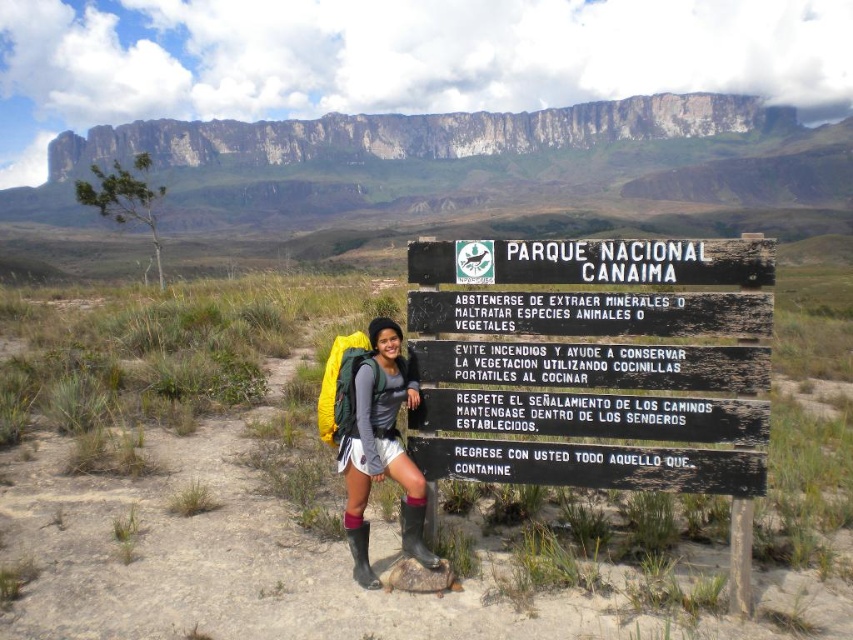
You are a hiker standing in front of the black wooden sign at center in Parque Nacional Canaima. You want to read the rules listed on the signboard without moving closer. Can you read the text clearly from your current position?

The black wooden sign at center is 5.04 meters away from viewer. Since the sign is 5.04 meters away and the text is written in Spanish, it might be difficult to read the text clearly without moving closer. However, the exact readability depends on factors like the text size and your eyesight, but the distance itself doesn

You are a park ranger in Canaima National Park. You need to check the rules on the black wooden sign at center and also ensure the matte green backpack at center is accessible. Since both are at center, which one is easier to reach without moving your position?

The matte green backpack at center is easier to reach because it is located below the black wooden sign at center, making it closer to your current position.